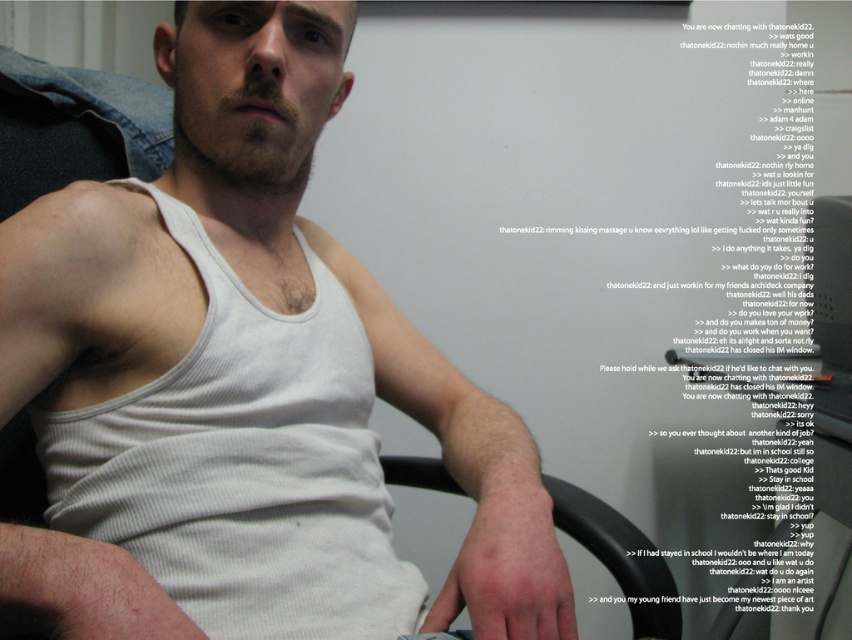
Question: Which point appears farthest from the camera in this image?

Choices:
 (A) (448, 492)
 (B) (258, 192)

Answer: (A)

Question: Which of the following is the farthest from the observer?

Choices:
 (A) tap(586, 541)
 (B) tap(159, 280)

Answer: (A)

Question: Which point appears closest to the camera in this image?

Choices:
 (A) (400, 458)
 (B) (67, 348)

Answer: (B)

Question: Does white ribbed tank top at center have a greater width compared to black plastic computer chair at lower center?

Choices:
 (A) yes
 (B) no

Answer: (A)

Question: Can you confirm if white ribbed tank top at center is smaller than black plastic computer chair at lower center?

Choices:
 (A) no
 (B) yes

Answer: (A)

Question: Can you confirm if white ribbed tank top at center is bigger than black plastic computer chair at lower center?

Choices:
 (A) no
 (B) yes

Answer: (B)